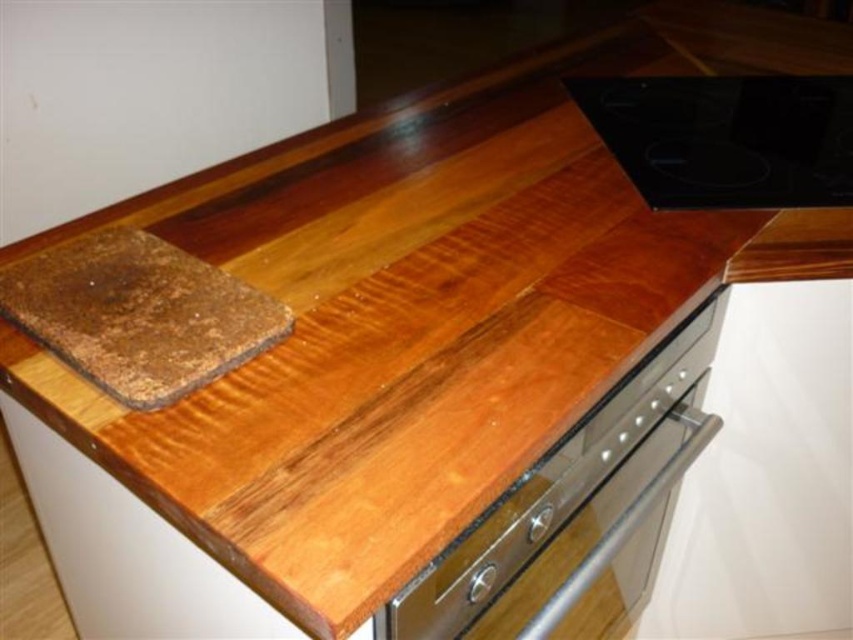
You are standing in the kitchen and see two points marked on the floor. The first point is at position point (x=624, y=509) and the second is at point (x=842, y=179). If you want to walk towards the oven door that is partially open, which point should you step on first?

Point (x=624, y=509) is in front of point (x=842, y=179), so you should step on point (x=624, y=509) first to reach the oven door more quickly.

You are a chef preparing to place a large baking tray on the kitchen surface. The tray requires a flat, heatproof area. Given the satin silver oven at lower center and the black glass cooktop at upper right, which surface can accommodate the tray and why?

The satin silver oven at lower center is larger in size than the black glass cooktop at upper right, so the satin silver oven at lower center can accommodate the large baking tray as it provides a bigger flat surface.

You are a chef preparing a meal and need to place a hot pan on the counter. You see the satin silver oven at lower center and the black glass cooktop at upper right. Which surface is above the other, and why?

The black glass cooktop at upper right is above the satin silver oven at lower center because the satin silver oven is positioned under the black glass cooktop according to the description.